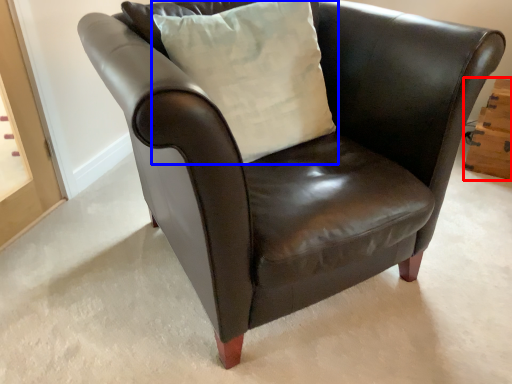
Question: Which point is further to the camera, drawer (highlighted by a red box) or pillow (highlighted by a blue box)?

Choices:
 (A) drawer
 (B) pillow

Answer: (A)